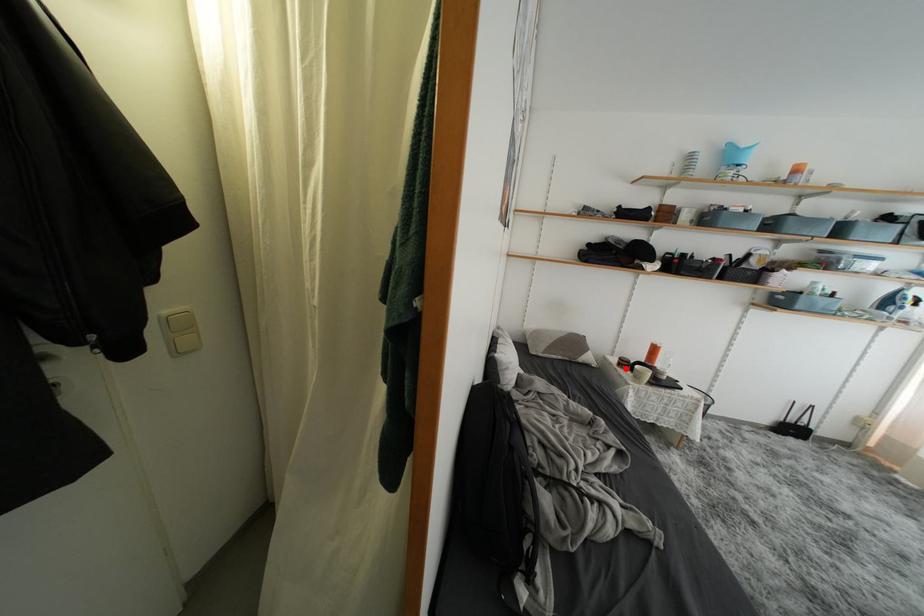
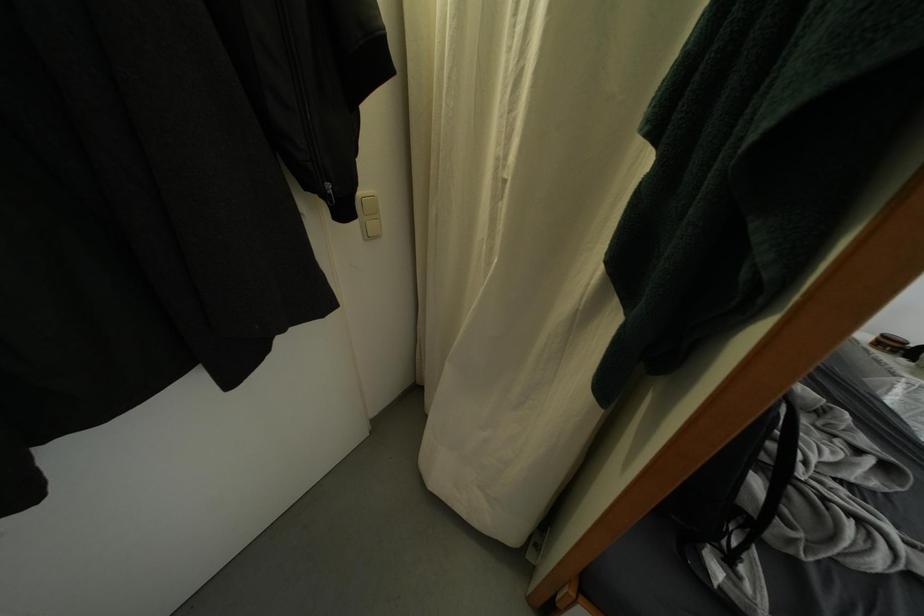
The point at the highlighted location is marked in the first image. Where is the corresponding point in the second image?

(884, 347)